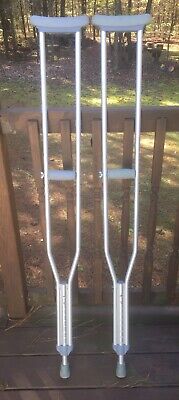
Find the location of a particular element. The image size is (179, 400). handle of left crutch is located at coordinates (117, 175).